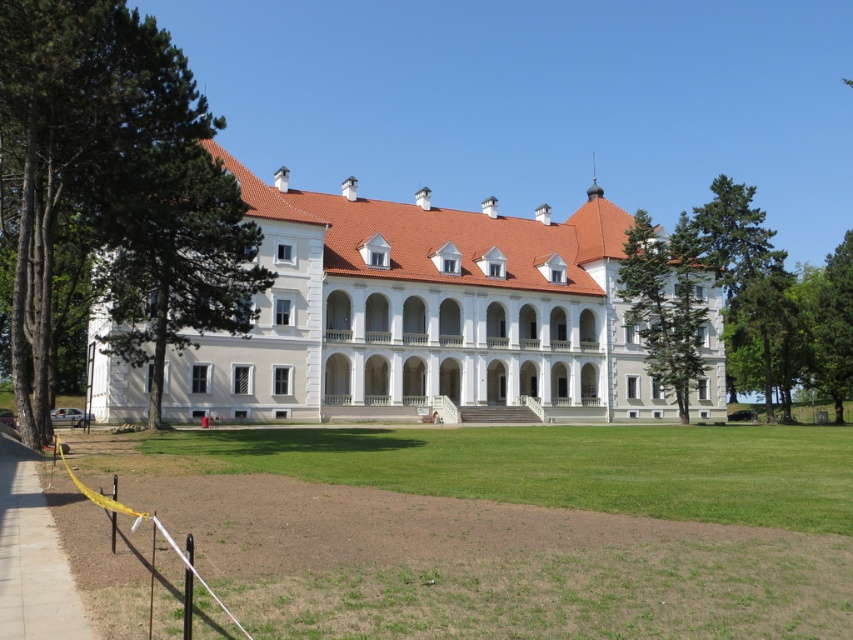
In the scene shown: Between green grass at center and green leafy tree at left, which one is positioned higher?

green leafy tree at left

Who is more forward, (480, 484) or (100, 113)?

Point (480, 484)

Who is more forward, [634,428] or [187,99]?

Point [187,99] is more forward.

The image size is (853, 640). I want to click on green grass at center, so click(563, 467).

Between green coniferous tree at right and green leafy tree at right, which one has more height?

green coniferous tree at right is taller.

Is point (767, 384) less distant than point (804, 339)?

Yes.

Which is behind, point (703, 253) or point (816, 346)?

The point (816, 346) is more distant.

Locate an element on the screen. The height and width of the screenshot is (640, 853). green coniferous tree at right is located at coordinates 746,280.

Which is below, green leafy tree at left or green coniferous tree at right?

green leafy tree at left

Can you confirm if green leafy tree at left is taller than green coniferous tree at right?

No.

Find the location of a particular element. The width and height of the screenshot is (853, 640). green leafy tree at left is located at coordinates (82, 150).